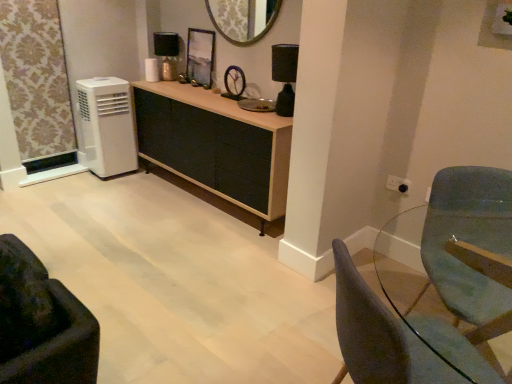
At what (x,y) coordinates should I click in order to perform the action: click on vacant area that is in front of metallic reflective frame at center. Please return your answer as a coordinate pair (x, y). The width and height of the screenshot is (512, 384). Looking at the image, I should click on (194, 91).